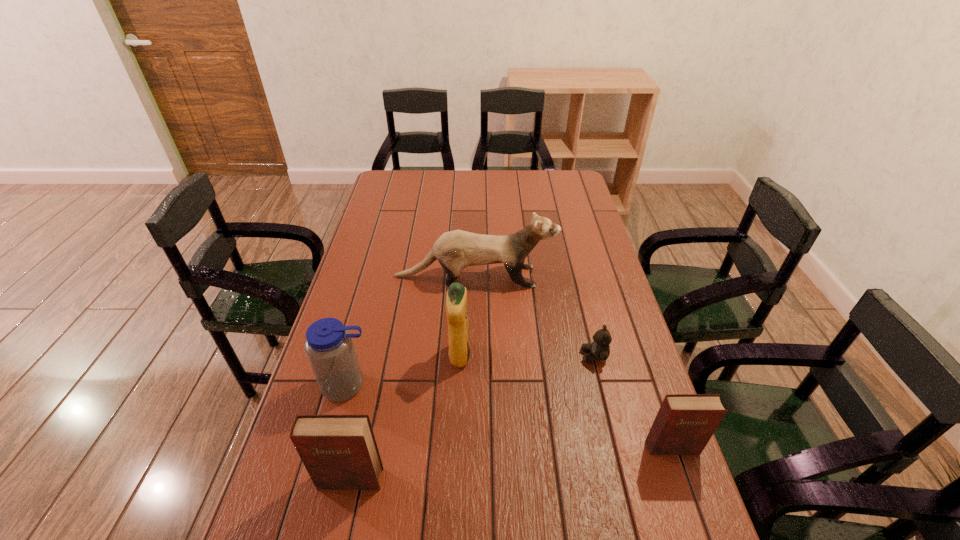
If we want them evenly spaced by inserting an extra diary among them, please locate a free spot for this new diary. Please provide its 2D coordinates. Your answer should be formatted as a tuple, i.e. [(x, y)], where the tuple contains the x and y coordinates of a point satisfying the conditions above.

[(516, 463)]